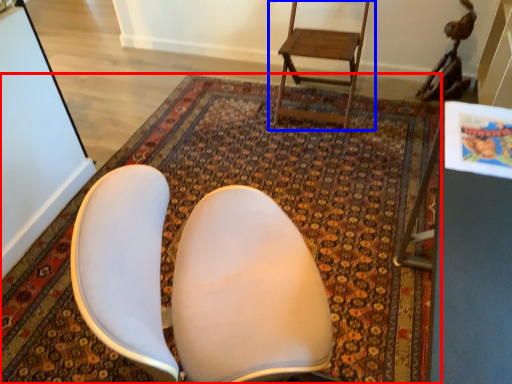
Question: Which object is further to the camera taking this photo, mat (highlighted by a red box) or chair (highlighted by a blue box)?

Choices:
 (A) mat
 (B) chair

Answer: (B)